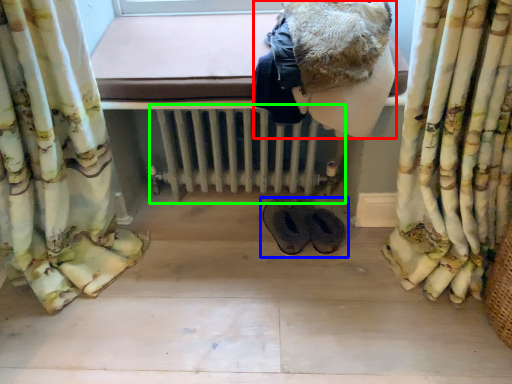
Question: Which object is positioned closest to clothing (highlighted by a red box)? Select from footwear (highlighted by a blue box) and radiator (highlighted by a green box).

Choices:
 (A) footwear
 (B) radiator

Answer: (B)